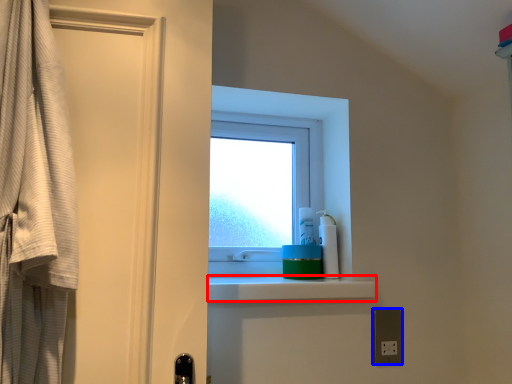
Question: Which object is closer to the camera taking this photo, balustrade (highlighted by a red box) or electric outlet (highlighted by a blue box)?

Choices:
 (A) balustrade
 (B) electric outlet

Answer: (A)